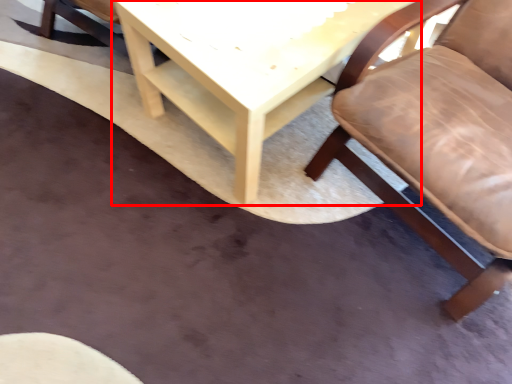
Question: From the image's perspective, where is table (annotated by the red box) located in relation to chair in the image?

Choices:
 (A) above
 (B) below

Answer: (A)